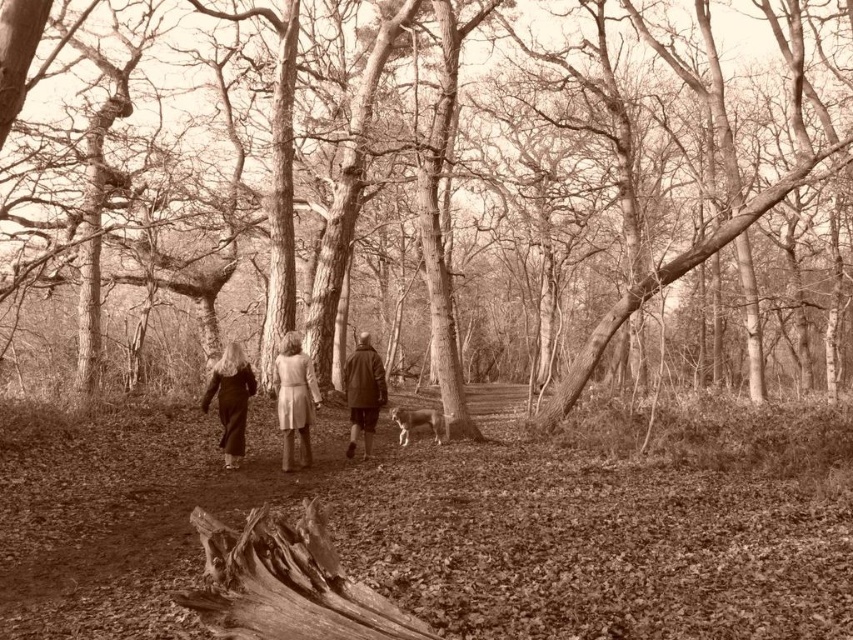
Question: Where is light brown wool coat at center located in relation to dark brown leather jacket at center in the image?

Choices:
 (A) above
 (B) below

Answer: (A)

Question: Considering the relative positions of smooth bark tree at center and rough bark log at lower left in the image provided, where is smooth bark tree at center located with respect to rough bark log at lower left?

Choices:
 (A) right
 (B) left

Answer: (A)

Question: Observing the image, what is the correct spatial positioning of smooth bark tree at center in reference to dark brown leather jacket at center?

Choices:
 (A) below
 (B) above

Answer: (B)

Question: Which of the following is the closest to the observer?

Choices:
 (A) (212, 394)
 (B) (357, 429)
 (C) (225, 541)
 (D) (310, 369)

Answer: (C)

Question: Which is nearer to the matte black coat at center?

Choices:
 (A) rough bark log at lower left
 (B) light brown wool coat at center
 (C) smooth bark tree at center
 (D) dark brown leather jacket at center

Answer: (B)

Question: Which object appears closest to the camera in this image?

Choices:
 (A) matte black coat at center
 (B) dark brown leather jacket at center
 (C) rough bark log at lower left

Answer: (C)